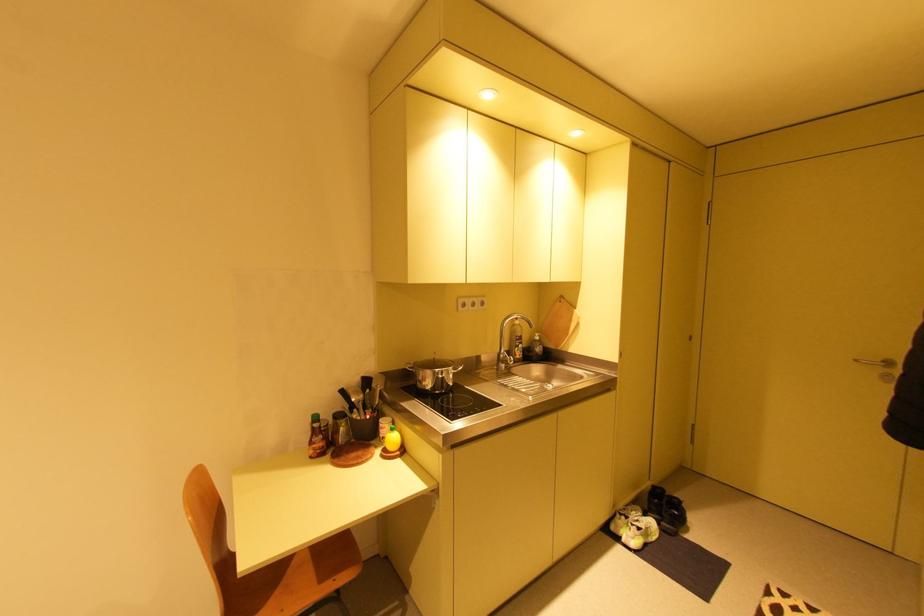
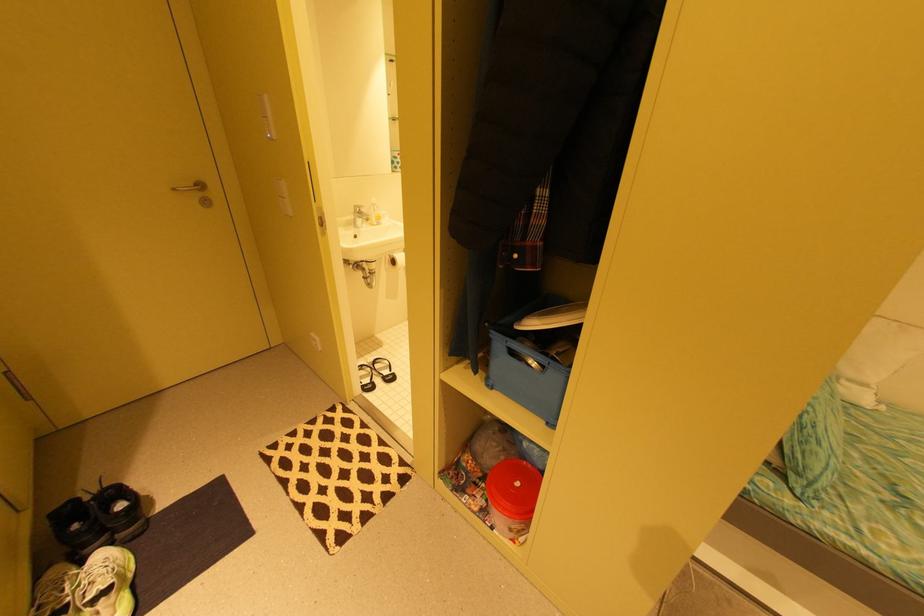
The images are taken continuously from a first-person perspective. In which direction is your viewpoint rotating?

The rotation direction of the camera is right-down.